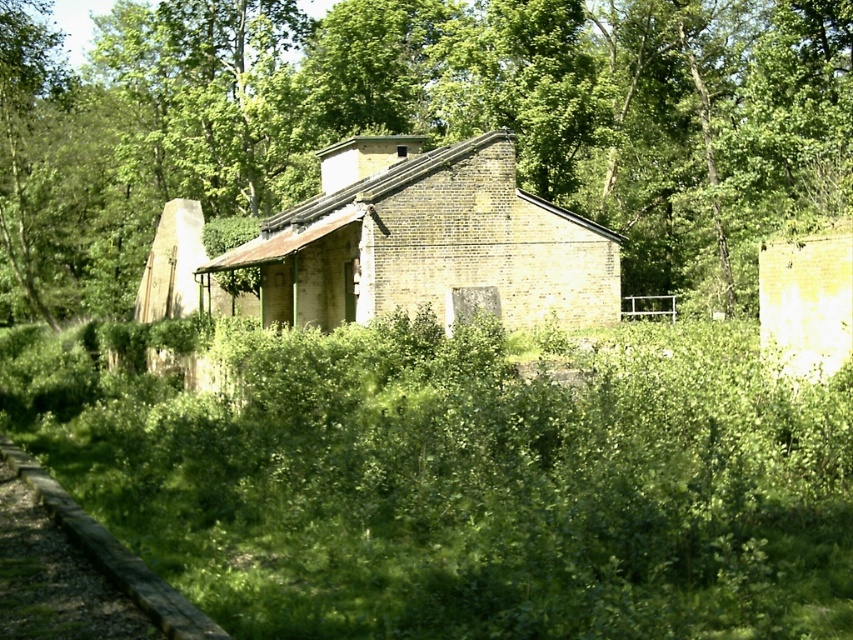
In the scene shown: Is green leafy tree at center to the left of yellow brick hut at center from the viewer's perspective?

Yes, green leafy tree at center is to the left of yellow brick hut at center.

Does green leafy tree at center appear under yellow brick hut at center?

Actually, green leafy tree at center is above yellow brick hut at center.

This screenshot has height=640, width=853. What are the coordinates of `green leafy tree at center` in the screenshot? It's located at (419, 122).